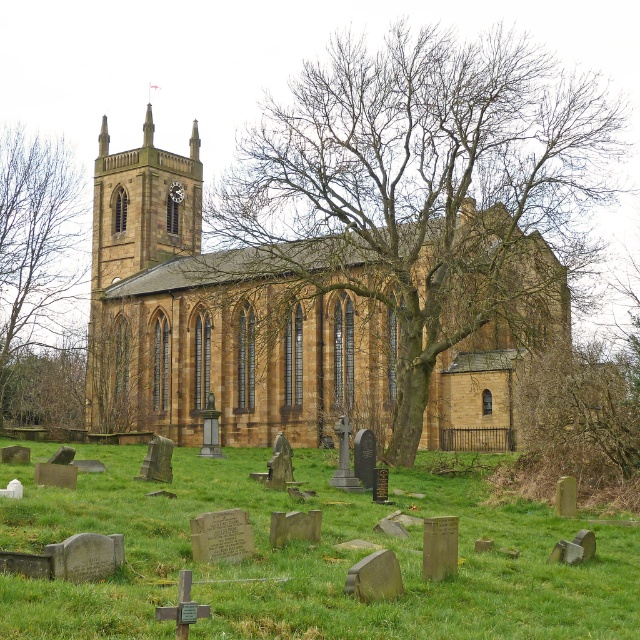
Can you confirm if green grass at lower center is positioned below brown stone tree at upper center?

Yes, green grass at lower center is below brown stone tree at upper center.

Between point (52, 625) and point (49, 256), which one is positioned in front?

Point (52, 625) is in front.

Is point (227, 605) behind point (12, 275)?

No, (227, 605) is in front of (12, 275).

The width and height of the screenshot is (640, 640). Identify the location of green grass at lower center. (307, 557).

Based on the photo, which is more to the right, green grass at lower center or brown stone clock tower at upper left?

green grass at lower center

Is green grass at lower center to the right of brown stone clock tower at upper left from the viewer's perspective?

Indeed, green grass at lower center is positioned on the right side of brown stone clock tower at upper left.

Image resolution: width=640 pixels, height=640 pixels. What do you see at coordinates (307, 557) in the screenshot?
I see `green grass at lower center` at bounding box center [307, 557].

Find the location of `green grass at lower center`. green grass at lower center is located at coordinates (307, 557).

Is bare branches at center thinner than green grass at lower center?

Incorrect, bare branches at center's width is not less than green grass at lower center's.

Does bare branches at center appear under green grass at lower center?

No.

Does point (269, 138) come farther from viewer compared to point (465, 593)?

Yes.

In order to click on bare branches at center in this screenshot , I will do `click(426, 186)`.